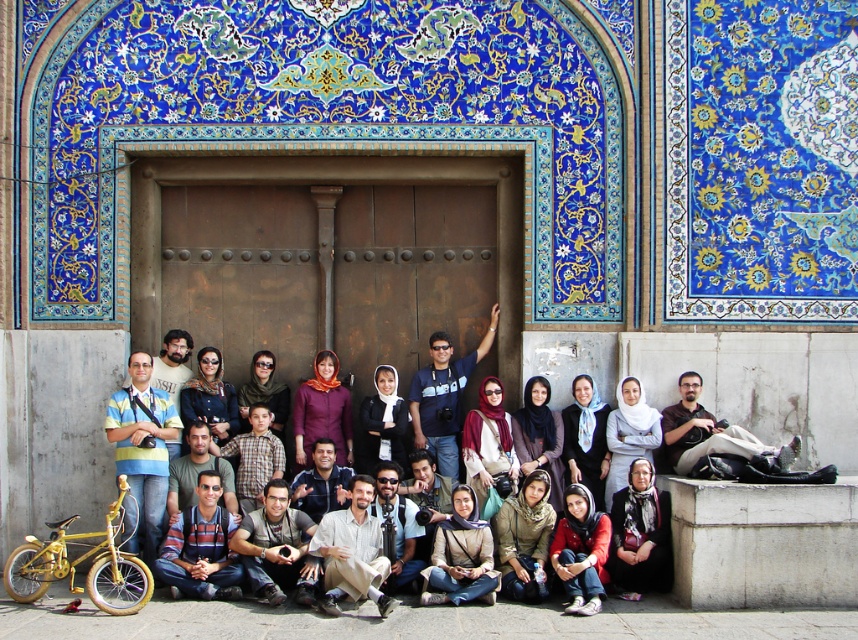
You are standing in front of the ornate door with blue tiles and want to take a photo of the matte black bicycle at lower left without including the door in the frame. Considering the distance, is the bicycle too far away to be captured clearly in a standard smartphone camera shot?

The matte black bicycle at lower left is 103.60 feet away from viewer. Standard smartphone cameras typically have difficulty capturing details clearly beyond 50 feet, so the bicycle may appear blurry or too small in the frame. Move closer or use a zoom feature for a better shot.

You are standing in front of the ornate door with blue tiles and want to take a photo of the matte black bicycle at lower left. Where should you position yourself relative to the point at coordinates (699, 372) to capture the bicycle in your shot?

The point at coordinates (699, 372) is located on the matte black bicycle at lower left. To capture the bicycle in your photo, position yourself so that the point at (699, 372) is within your camera frame.